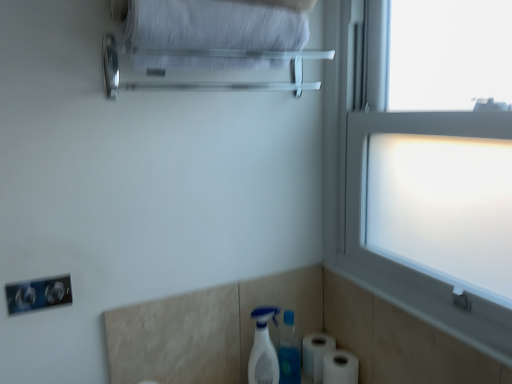
This screenshot has height=384, width=512. What do you see at coordinates (212, 58) in the screenshot?
I see `satin silver towel bar at upper center` at bounding box center [212, 58].

Identify the location of white plastic spray bottle at lower center. This screenshot has height=384, width=512. (263, 349).

From the picture: Is white plastic spray bottle at lower center thinner than satin silver towel bar at upper center?

Correct, the width of white plastic spray bottle at lower center is less than that of satin silver towel bar at upper center.

Is white plastic spray bottle at lower center not close to satin silver towel bar at upper center?

No, white plastic spray bottle at lower center is not far away from satin silver towel bar at upper center.

Which is more to the right, white plastic spray bottle at lower center or satin silver towel bar at upper center?

white plastic spray bottle at lower center is more to the right.

From the picture: Do you think white plastic spray bottle at lower center is within satin silver towel bar at upper center, or outside of it?

white plastic spray bottle at lower center exists outside the volume of satin silver towel bar at upper center.

From a real-world perspective, who is located higher, white matte toilet paper at lower right, the 1th toilet paper viewed from the back, or frosted glass window at right?

From a 3D spatial view, frosted glass window at right is above.

Is point (319, 338) closer or farther from the camera than point (490, 343)?

Point (319, 338).

Identify the location of window that is above the white matte toilet paper at lower right, the 1th toilet paper viewed from the back (from the image's perspective). This screenshot has height=384, width=512. (364, 198).

Does white matte toilet paper at lower right, the 1th toilet paper viewed from the back, have a lesser width compared to frosted glass window at right?

Correct, the width of white matte toilet paper at lower right, the 1th toilet paper viewed from the back, is less than that of frosted glass window at right.

From their relative heights in the image, would you say white fabric bath towel at upper center is taller or shorter than frosted glass window at right?

Considering their sizes, white fabric bath towel at upper center has less height than frosted glass window at right.

From a real-world perspective, is white fabric bath towel at upper center on frosted glass window at right?

Yes, from a real-world perspective, white fabric bath towel at upper center is over frosted glass window at right

Is frosted glass window at right completely or partially inside white fabric bath towel at upper center?

Definitely not — frosted glass window at right is not inside white fabric bath towel at upper center.

Measure the distance from white fabric bath towel at upper center to frosted glass window at right.

white fabric bath towel at upper center is 19.50 inches away from frosted glass window at right.

Does point (298, 86) lie behind point (330, 345)?

No, (298, 86) is in front of (330, 345).

Does satin silver towel bar at upper center have a lesser width compared to white matte toilet paper at lower right, positioned as the 2th toilet paper in front-to-back order?

No.

Who is bigger, satin silver towel bar at upper center or white matte toilet paper at lower right, positioned as the 2th toilet paper in front-to-back order?

Bigger between the two is satin silver towel bar at upper center.

Is satin silver towel bar at upper center oriented towards white matte toilet paper at lower right, positioned as the 2th toilet paper in front-to-back order?

No, satin silver towel bar at upper center does not turn towards white matte toilet paper at lower right, positioned as the 2th toilet paper in front-to-back order.

Is white matte toilet paper at lower right, the first toilet paper when ordered from front to back, situated inside white matte toilet paper at lower right, positioned as the 2th toilet paper in front-to-back order, or outside?

white matte toilet paper at lower right, the first toilet paper when ordered from front to back, lies outside white matte toilet paper at lower right, positioned as the 2th toilet paper in front-to-back order.

The height and width of the screenshot is (384, 512). What are the coordinates of `toilet paper above the white matte toilet paper at lower right, the 1th toilet paper viewed from the back (from a real-world perspective)` in the screenshot? It's located at (340, 367).

From the picture: Is white matte toilet paper at lower right, the first toilet paper when ordered from front to back, next to white matte toilet paper at lower right, positioned as the 2th toilet paper in front-to-back order?

Yes.

Is white matte toilet paper at lower right, the first toilet paper when ordered from front to back, oriented away from white matte toilet paper at lower right, the 1th toilet paper viewed from the back?

No, white matte toilet paper at lower right, the first toilet paper when ordered from front to back,'s orientation is not away from white matte toilet paper at lower right, the 1th toilet paper viewed from the back.

Looking at this image, would you say white plastic spray bottle at lower center is a long distance from white matte toilet paper at lower right, positioned as the 2th toilet paper in front-to-back order?

white plastic spray bottle at lower center is near white matte toilet paper at lower right, positioned as the 2th toilet paper in front-to-back order, not far away.

Considering the relative sizes of white plastic spray bottle at lower center and white matte toilet paper at lower right, positioned as the 2th toilet paper in front-to-back order, in the image provided, is white plastic spray bottle at lower center smaller than white matte toilet paper at lower right, positioned as the 2th toilet paper in front-to-back order,?

No, white plastic spray bottle at lower center is not smaller than white matte toilet paper at lower right, positioned as the 2th toilet paper in front-to-back order.

Identify the location of the 2nd toilet paper below the white plastic spray bottle at lower center (from a real-world perspective). This screenshot has width=512, height=384. (316, 354).

Is white fabric bath towel at upper center positioned with its back to white matte toilet paper at lower right, the first toilet paper when ordered from front to back?

No.

Can you see white fabric bath towel at upper center touching white matte toilet paper at lower right, which appears as the second toilet paper when viewed from the back?

No, white fabric bath towel at upper center is not in contact with white matte toilet paper at lower right, which appears as the second toilet paper when viewed from the back.

Can you confirm if white fabric bath towel at upper center is taller than white matte toilet paper at lower right, which appears as the second toilet paper when viewed from the back?

Yes.

What's the angular difference between white fabric bath towel at upper center and white matte toilet paper at lower right, which appears as the second toilet paper when viewed from the back,'s facing directions?

90.8 degrees separate the facing orientations of white fabric bath towel at upper center and white matte toilet paper at lower right, which appears as the second toilet paper when viewed from the back.

I want to click on cleaning product below the satin silver towel bar at upper center (from a real-world perspective), so click(263, 349).

Locate an element on the screen. the 2nd toilet paper behind the frosted glass window at right, starting your count from the anchor is located at coordinates (316, 354).

Considering their positions, is white fabric bath towel at upper center positioned further to satin silver towel bar at upper center than white plastic spray bottle at lower center?

Based on the image, white plastic spray bottle at lower center appears to be further to satin silver towel bar at upper center.

Estimate the real-world distances between objects in this image. Which object is closer to white fabric bath towel at upper center, white plastic spray bottle at lower center or white matte toilet paper at lower right, the first toilet paper when ordered from front to back?

white plastic spray bottle at lower center is positioned closer to the anchor white fabric bath towel at upper center.

When comparing their distances from white matte toilet paper at lower right, the 1th toilet paper viewed from the back, does white matte toilet paper at lower right, the first toilet paper when ordered from front to back, or white fabric bath towel at upper center seem further?

Among the two, white fabric bath towel at upper center is located further to white matte toilet paper at lower right, the 1th toilet paper viewed from the back.

Looking at the image, which one is located further to white fabric bath towel at upper center, white plastic spray bottle at lower center or satin silver towel bar at upper center?

white plastic spray bottle at lower center lies further to white fabric bath towel at upper center than the other object.

Based on the photo, estimate the real-world distances between objects in this image. Which object is further from satin silver towel bar at upper center, frosted glass window at right or white plastic spray bottle at lower center?

The object further to satin silver towel bar at upper center is white plastic spray bottle at lower center.

Based on their spatial positions, is frosted glass window at right or white fabric bath towel at upper center closer to white matte toilet paper at lower right, the first toilet paper when ordered from front to back?

frosted glass window at right.

Looking at the image, which one is located further to satin silver towel bar at upper center, white fabric bath towel at upper center or white matte toilet paper at lower right, the 1th toilet paper viewed from the back?

white matte toilet paper at lower right, the 1th toilet paper viewed from the back, is further to satin silver towel bar at upper center.

From the image, which object appears to be nearer to frosted glass window at right, white matte toilet paper at lower right, which appears as the second toilet paper when viewed from the back, or white matte toilet paper at lower right, positioned as the 2th toilet paper in front-to-back order?

white matte toilet paper at lower right, positioned as the 2th toilet paper in front-to-back order, is positioned closer to the anchor frosted glass window at right.

You are a GUI agent. You are given a task and a screenshot of the screen. Output one action in this format:
    pyautogui.click(x=<x>, y=<y>)
    Task: Click on the toilet paper between frosted glass window at right and white matte toilet paper at lower right, the first toilet paper when ordered from front to back, vertically
    
    Given the screenshot: What is the action you would take?
    pyautogui.click(x=316, y=354)

Locate an element on the screen. Image resolution: width=512 pixels, height=384 pixels. cleaning product that lies between satin silver towel bar at upper center and white matte toilet paper at lower right, positioned as the 2th toilet paper in front-to-back order, from top to bottom is located at coordinates (263, 349).

Locate an element on the screen. cleaning product between white fabric bath towel at upper center and white matte toilet paper at lower right, the 1th toilet paper viewed from the back, vertically is located at coordinates (263, 349).

Locate an element on the screen. This screenshot has height=384, width=512. window between satin silver towel bar at upper center and white plastic spray bottle at lower center from top to bottom is located at coordinates (364, 198).